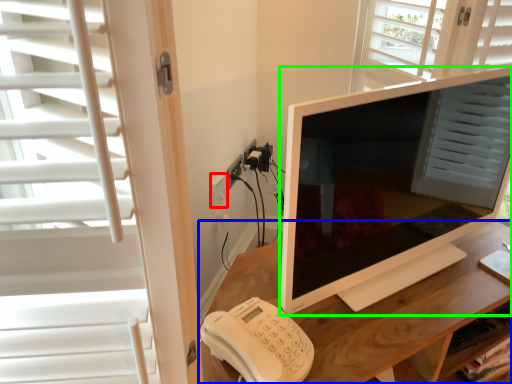
Question: Which object is the farthest from electric outlet (highlighted by a red box)? Choose among these: desk (highlighted by a blue box) or television (highlighted by a green box).

Choices:
 (A) desk
 (B) television

Answer: (B)